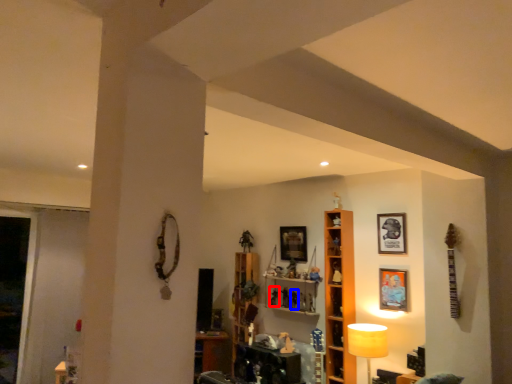
Question: Which point is further to the camera, toy (highlighted by a red box) or toy (highlighted by a blue box)?

Choices:
 (A) toy
 (B) toy

Answer: (A)